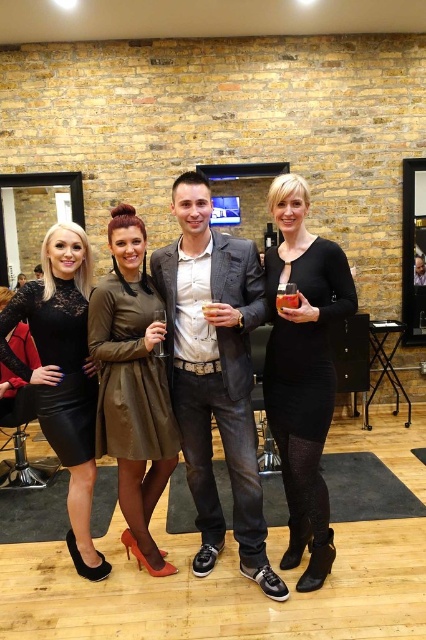
You are a photographer at this event and want to capture a clear photo of the leather dress at center without the translucent plastic cup at center blocking it. What should you do?

Move the camera forward to get closer to the leather dress at center so that the translucent plastic cup at center is no longer in front of it.

You are a photographer setting up for a group photo. You have a matte gray blazer at center and a black leather dress at lower left in your frame. Which clothing item takes up more space in the photo?

The matte gray blazer at center takes up more space in the photo because it is bigger than the black leather dress at lower left.

From the picture: You are standing at the entrance of the salon and see the group of four people. There is a point marked at coordinates (302, 371). Which object from the group is this point located on?

The point marked at coordinates (302, 371) is located on the black leather dress at center.